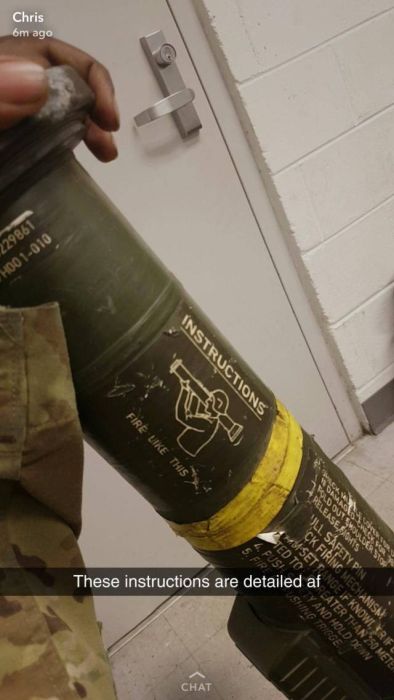
Identify the location of door handle. The image size is (394, 700). [168, 92].